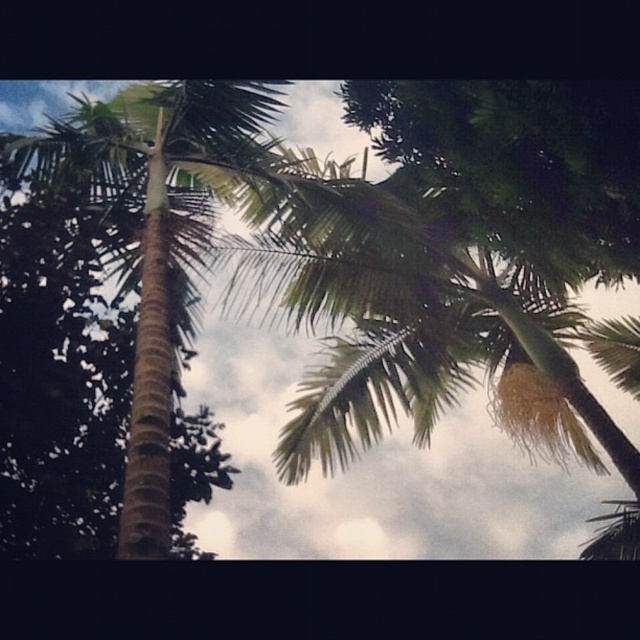
Question: Which point is closer to the camera taking this photo?

Choices:
 (A) (284, 186)
 (B) (508, 243)

Answer: (A)

Question: Which of the following is the farthest from the observer?

Choices:
 (A) (132, 449)
 (B) (410, 195)

Answer: (B)

Question: Does green leafy coconut tree at upper center appear on the left side of green leafy palm tree at left?

Choices:
 (A) yes
 (B) no

Answer: (B)

Question: Is green leafy coconut tree at upper center bigger than green leafy palm tree at left?

Choices:
 (A) yes
 (B) no

Answer: (A)

Question: Can you confirm if green leafy coconut tree at upper center is wider than green leafy palm tree at left?

Choices:
 (A) no
 (B) yes

Answer: (B)